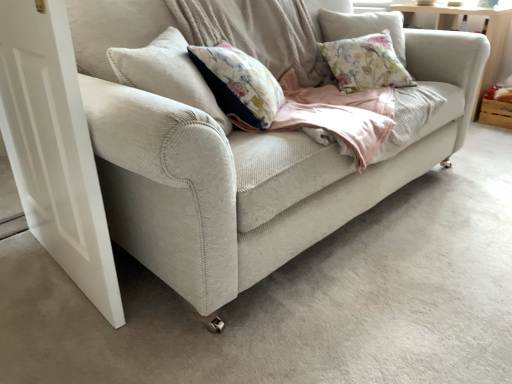
Question: Looking at their shapes, would you say wooden crate at right is wider or thinner than white matte door at left?

Choices:
 (A) thin
 (B) wide

Answer: (B)

Question: From a real-world perspective, relative to white matte door at left, is wooden crate at right vertically above or below?

Choices:
 (A) above
 (B) below

Answer: (B)

Question: Based on their relative distances, which object is farther from the light beige fabric couch at center?

Choices:
 (A) wooden crate at right
 (B) white matte door at left

Answer: (A)

Question: Which of these objects is positioned closest to the light beige fabric couch at center?

Choices:
 (A) white matte door at left
 (B) wooden crate at right

Answer: (A)